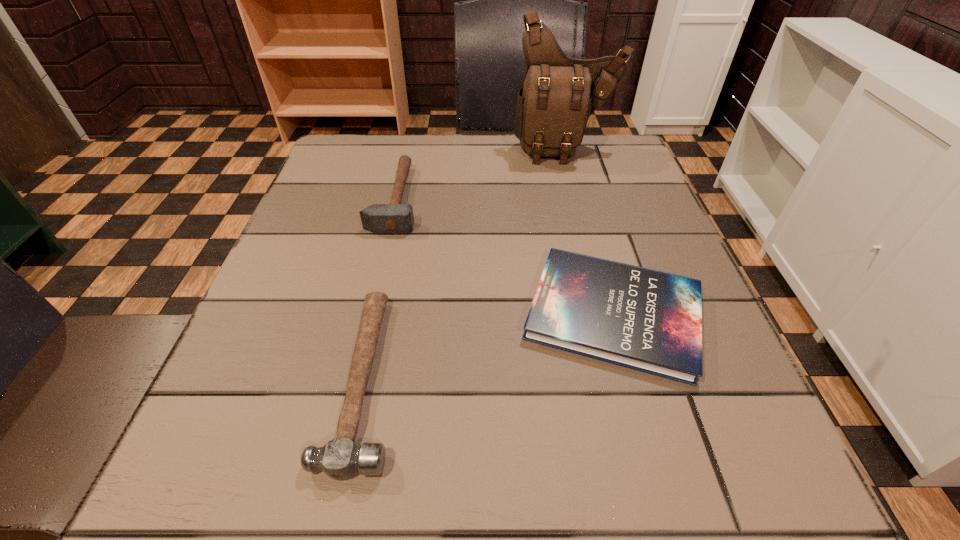
You are a GUI agent. You are given a task and a screenshot of the screen. Output one action in this format:
    pyautogui.click(x=<x>, y=<y>)
    Task: Click on the blank space located on the back of the shortest object
    The width and height of the screenshot is (960, 540).
    Given the screenshot: What is the action you would take?
    pyautogui.click(x=583, y=204)

You are a GUI agent. You are given a task and a screenshot of the screen. Output one action in this format:
    pyautogui.click(x=<x>, y=<y>)
    Task: Click on the shoulder bag positioned at the far edge
    The width and height of the screenshot is (960, 540).
    Given the screenshot: What is the action you would take?
    pyautogui.click(x=558, y=95)

I want to click on hammer located in the far edge section of the desktop, so click(395, 217).

In order to click on object that is positioned at the near edge in this screenshot , I will do `click(340, 458)`.

I want to click on shoulder bag present at the right edge, so click(x=558, y=95).

What are the coordinates of `hardback book present at the right edge` in the screenshot? It's located at (643, 319).

The image size is (960, 540). I want to click on object that is at the far left corner, so click(395, 217).

At what (x,y) coordinates should I click in order to perform the action: click on object that is positioned at the near left corner. Please return your answer as a coordinate pair (x, y). The height and width of the screenshot is (540, 960). Looking at the image, I should click on (340, 458).

Locate an element on the screen. This screenshot has height=540, width=960. object at the far right corner is located at coordinates (558, 95).

This screenshot has height=540, width=960. I want to click on free spot at the far edge of the desktop, so click(x=444, y=173).